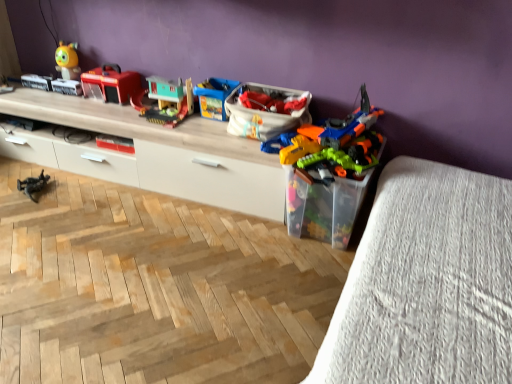
This screenshot has height=384, width=512. I want to click on vacant area that is in front of wooden at upper left, so click(x=130, y=252).